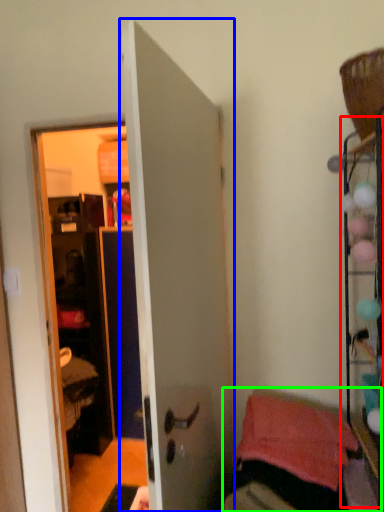
Question: Considering the real-world distances, which object is closest to shelf (highlighted by a red box)? door (highlighted by a blue box) or furniture (highlighted by a green box).

Choices:
 (A) door
 (B) furniture

Answer: (B)